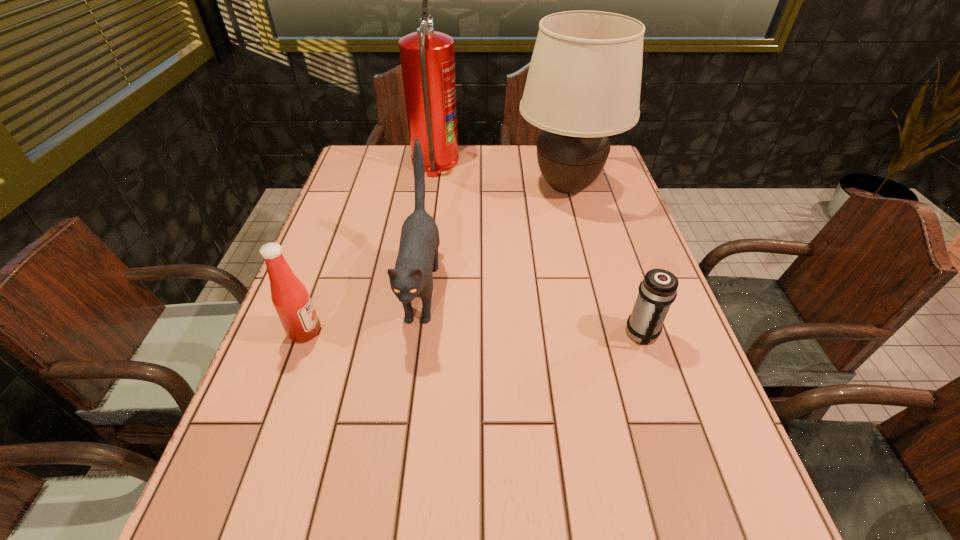
Identify which object is the fourth closest to the fire extinguisher. Please provide its 2D coordinates. Your answer should be formatted as a tuple, i.e. [(x, y)], where the tuple contains the x and y coordinates of a point satisfying the conditions above.

[(658, 290)]

Find the location of `object that stands as the third closest to the condiment`. object that stands as the third closest to the condiment is located at coordinates (427, 57).

The width and height of the screenshot is (960, 540). I want to click on free space that satisfies the following two spatial constraints: 1. on the instruction side of the lampshade; 2. on the left side of the fire extinguisher, so click(x=431, y=187).

Locate an element on the screen. This screenshot has width=960, height=540. vacant space that satisfies the following two spatial constraints: 1. on the instruction side of the fire extinguisher; 2. on the left side of the lampshade is located at coordinates (431, 187).

The image size is (960, 540). I want to click on blank area in the image that satisfies the following two spatial constraints: 1. on the instruction side of the fire extinguisher; 2. on the right side of the lampshade, so click(431, 187).